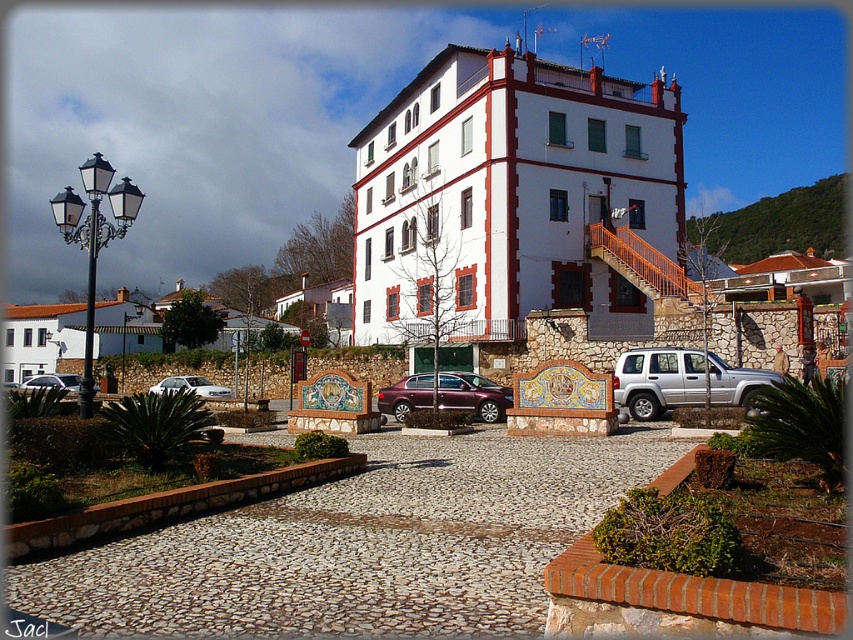
You are a delivery driver who needs to park your vehicle in this area. You have a tall delivery van that requires a parking spot with enough height clearance. Based on the scene, which vehicle among the silver metallic suv at right and the matte maroon sedan at center is taller, indicating the minimum height requirement for the parking spot?

The silver metallic suv at right is taller than the matte maroon sedan at center, so the parking spot must accommodate at least the height of the silver metallic suv at right to ensure clearance.

You are standing in front of the building and want to check if the silver metallic suv at right is within a 60 feet safety zone. Is it within the zone?

The silver metallic suv at right is 55.12 feet away from viewer, so yes, it is within the 60 feet safety zone.

You are a delivery person who needs to park a silver metallic suv at right and a white glossy sedan at lower left in the parking lot. Which vehicle should you park closer to the building entrance to ensure both fit within the available space?

The silver metallic suv at right is smaller than the white glossy sedan at lower left, so you should park the silver metallic suv at right closer to the building entrance to accommodate both vehicles within the space.